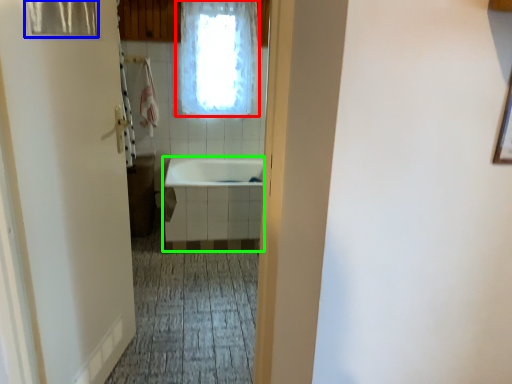
Question: Which is farther away from window (highlighted by a red box)? shower curtain (highlighted by a blue box) or bath (highlighted by a green box)?

Choices:
 (A) shower curtain
 (B) bath

Answer: (A)